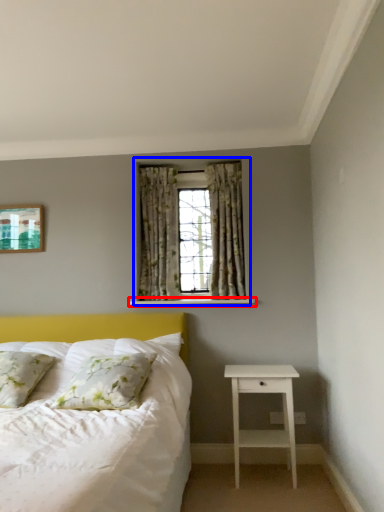
Question: Which of the following is the farthest to the observer, window sill (highlighted by a red box) or window (highlighted by a blue box)?

Choices:
 (A) window sill
 (B) window

Answer: (B)